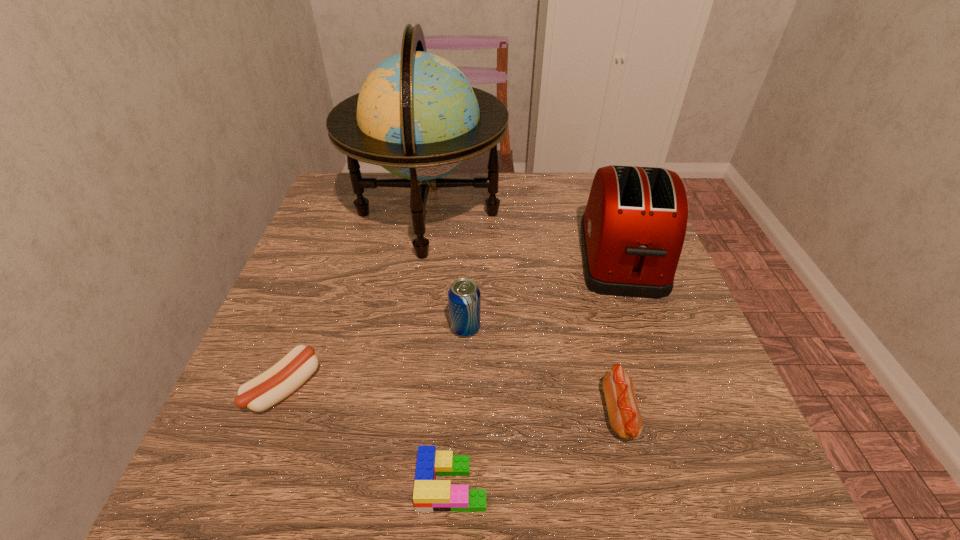
I want to click on vacant space located on the left of the right sausage, so click(x=544, y=413).

The width and height of the screenshot is (960, 540). Find the location of `free location located on the back of the left sausage`. free location located on the back of the left sausage is located at coordinates (345, 229).

Where is `free space located on the right of the nearest object`? The width and height of the screenshot is (960, 540). free space located on the right of the nearest object is located at coordinates pyautogui.click(x=588, y=484).

Find the location of a particular element. object that is at the far edge is located at coordinates (416, 115).

I want to click on object that is at the near edge, so click(430, 495).

Locate an element on the screen. The width and height of the screenshot is (960, 540). globe at the left edge is located at coordinates (416, 115).

Find the location of a particular element. sausage positioned at the left edge is located at coordinates (275, 384).

Where is `object at the right edge`? This screenshot has height=540, width=960. object at the right edge is located at coordinates (632, 231).

Locate an element on the screen. The height and width of the screenshot is (540, 960). object situated at the far left corner is located at coordinates [416, 115].

In the image, there is a desktop. Where is `blank space at the far edge`? blank space at the far edge is located at coordinates (x=568, y=204).